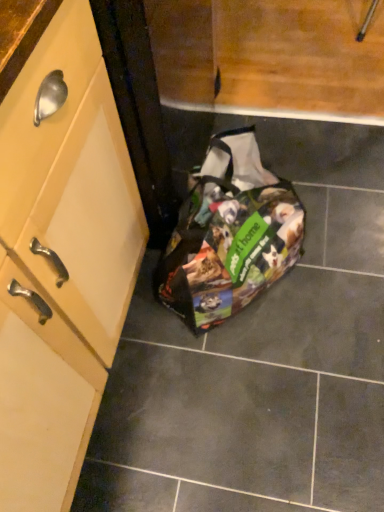
I want to click on vacant space behind printed fabric bag at lower center, so (x=278, y=146).